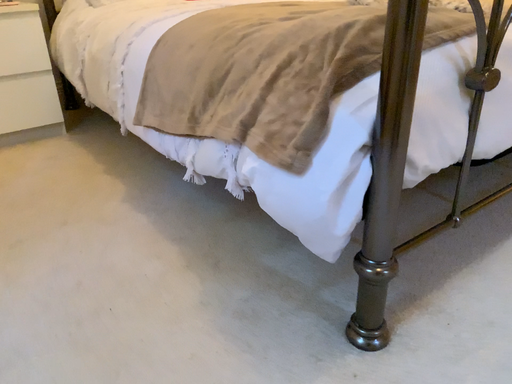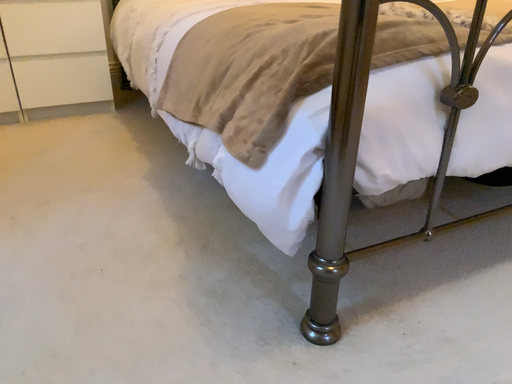
Question: How did the camera likely rotate when shooting the video?

Choices:
 (A) rotated left
 (B) rotated right

Answer: (A)